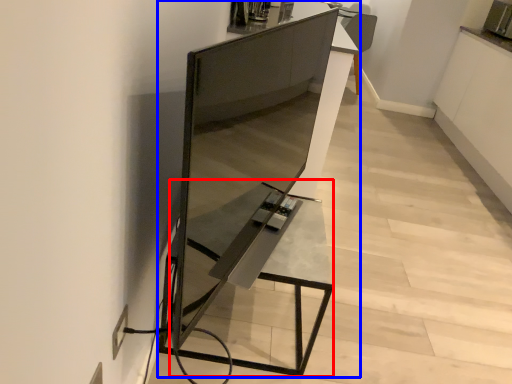
Question: Which of the following is the closest to the observer, table (highlighted by a red box) or furniture (highlighted by a blue box)?

Choices:
 (A) table
 (B) furniture

Answer: (B)